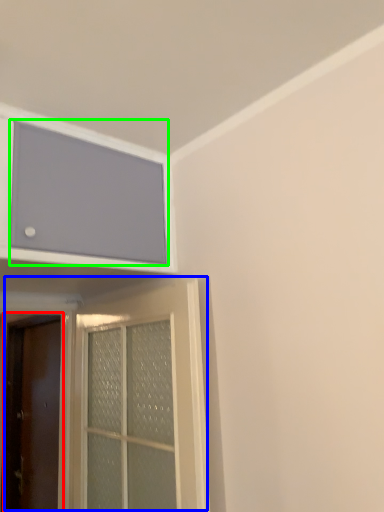
Question: Which object is positioned closest to door (highlighted by a red box)? Select from door (highlighted by a blue box) and window screen (highlighted by a green box).

Choices:
 (A) door
 (B) window screen

Answer: (A)